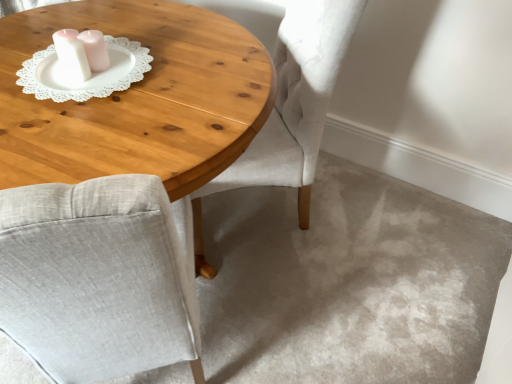
Question: Does point (5, 38) appear closer or farther from the camera than point (285, 76)?

Choices:
 (A) closer
 (B) farther

Answer: (A)

Question: From a real-world perspective, is wooden coffee table at center physically located above or below light gray fabric chair at center?

Choices:
 (A) above
 (B) below

Answer: (B)

Question: Estimate the real-world distances between objects in this image. Which object is farther from the light gray fabric chair at center?

Choices:
 (A) white lace doily at upper left
 (B) wooden coffee table at center

Answer: (A)

Question: Estimate the real-world distances between objects in this image. Which object is farther from the wooden coffee table at center?

Choices:
 (A) light gray fabric chair at center
 (B) white lace doily at upper left

Answer: (A)